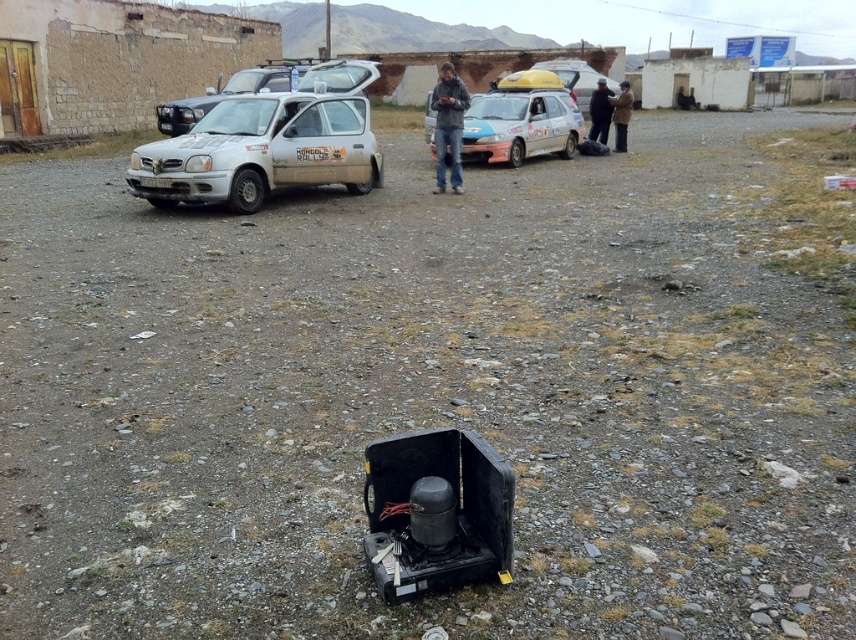
Question: Considering the relative positions of white matte hatchback at center-left and matte white car at center in the image provided, where is white matte hatchback at center-left located with respect to matte white car at center?

Choices:
 (A) above
 (B) below

Answer: (B)

Question: Considering the relative positions of matte white car at center and dark blue fabric jacket at upper center in the image provided, where is matte white car at center located with respect to dark blue fabric jacket at upper center?

Choices:
 (A) below
 (B) above

Answer: (A)

Question: Which of these objects is positioned farthest from the dark blue fabric jacket at upper center?

Choices:
 (A) white matte hatchback at center-left
 (B) matte white car at center
 (C) white matte car at upper center
 (D) gray matte jacket at center

Answer: (A)

Question: Which object is positioned closest to the white matte car at upper center?

Choices:
 (A) dark blue fabric jacket at upper center
 (B) gray matte jacket at center
 (C) white matte hatchback at center-left

Answer: (B)

Question: Is white matte hatchback at center-left wider than white matte car at upper center?

Choices:
 (A) no
 (B) yes

Answer: (B)

Question: Which point is closer to the camera taking this photo?

Choices:
 (A) (625, 136)
 (B) (544, 83)

Answer: (A)